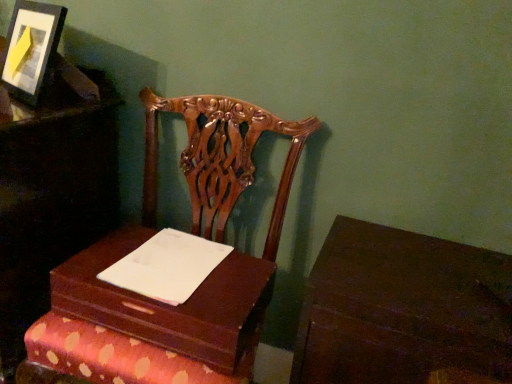
Image resolution: width=512 pixels, height=384 pixels. Describe the element at coordinates (167, 266) in the screenshot. I see `white paper at center` at that location.

Where is `wooden chair at left, which is the first furniture in left-to-right order`? This screenshot has height=384, width=512. wooden chair at left, which is the first furniture in left-to-right order is located at coordinates (53, 197).

At what (x,y) coordinates should I click in order to perform the action: click on white paper at center. Please return your answer as a coordinate pair (x, y). This screenshot has width=512, height=384. Looking at the image, I should click on (167, 266).

From a real-world perspective, is dark wood table at lower right physically above matte black picture frame at upper left?

Incorrect, from a real-world perspective, dark wood table at lower right is lower than matte black picture frame at upper left.

Based on the photo, which of these two, dark wood table at lower right or matte black picture frame at upper left, stands shorter?

matte black picture frame at upper left is shorter.

At what (x,y) coordinates should I click in order to perform the action: click on table located underneath the matte black picture frame at upper left (from a real-world perspective). Please return your answer as a coordinate pair (x, y). The width and height of the screenshot is (512, 384). Looking at the image, I should click on (403, 309).

Which object is further away from the camera, dark wood table at lower right or matte black picture frame at upper left?

Positioned behind is matte black picture frame at upper left.

From the image's perspective, between matte black picture frame at upper left and dark wood table at lower right, who is located below?

dark wood table at lower right is shown below in the image.

Considering the positions of objects matte black picture frame at upper left and dark wood table at lower right in the image provided, who is behind, matte black picture frame at upper left or dark wood table at lower right?

matte black picture frame at upper left is more distant.

Considering the relative sizes of matte black picture frame at upper left and dark wood table at lower right in the image provided, is matte black picture frame at upper left bigger than dark wood table at lower right?

Actually, matte black picture frame at upper left might be smaller than dark wood table at lower right.

Based on the photo, is matte black picture frame at upper left aimed at dark wood table at lower right?

No.

From a real-world perspective, which is physically below, white paper at center or dark wood table at lower right?

dark wood table at lower right, from a real-world perspective.

In the scene shown: In terms of height, does white paper at center look taller or shorter compared to dark wood table at lower right?

In the image, white paper at center appears to be shorter than dark wood table at lower right.

Which object is closer to the camera, white paper at center or dark wood table at lower right?

dark wood table at lower right is more forward.

Looking at this image, is mahogany wood chair at center, the 1th furniture positioned from the right, facing away from wooden chair at left, marked as the 2th furniture in a right-to-left arrangement?

No, mahogany wood chair at center, the 1th furniture positioned from the right, is not facing the opposite direction of wooden chair at left, marked as the 2th furniture in a right-to-left arrangement.

From a real-world perspective, is mahogany wood chair at center, the 2th furniture viewed from the left, over wooden chair at left, which is the first furniture in left-to-right order?

Yes, from a real-world perspective, mahogany wood chair at center, the 2th furniture viewed from the left, is above wooden chair at left, which is the first furniture in left-to-right order.

Looking at this image, is mahogany wood chair at center, the 1th furniture positioned from the right, to the left or to the right of wooden chair at left, which is the first furniture in left-to-right order, in the image?

From the image, it's evident that mahogany wood chair at center, the 1th furniture positioned from the right, is to the right of wooden chair at left, which is the first furniture in left-to-right order.

Is mahogany wood chair at center, the 1th furniture positioned from the right, situated inside wooden chair at left, which is the first furniture in left-to-right order, or outside?

mahogany wood chair at center, the 1th furniture positioned from the right, exists outside the volume of wooden chair at left, which is the first furniture in left-to-right order.

Is mahogany wood chair at center, the 1th furniture positioned from the right, facing towards white paper at center?

Yes, mahogany wood chair at center, the 1th furniture positioned from the right, is aimed at white paper at center.

From the image's perspective, which is above, mahogany wood chair at center, the 1th furniture positioned from the right, or white paper at center?

white paper at center is shown above in the image.

Can you confirm if mahogany wood chair at center, the 2th furniture viewed from the left, is smaller than white paper at center?

Incorrect, mahogany wood chair at center, the 2th furniture viewed from the left, is not smaller in size than white paper at center.

Measure the distance from mahogany wood chair at center, the 2th furniture viewed from the left, to white paper at center.

mahogany wood chair at center, the 2th furniture viewed from the left, is 12.03 centimeters from white paper at center.

Does point (453, 280) lie behind point (165, 288)?

No, it is not.

Measure the distance between dark wood table at lower right and white paper at center.

The distance of dark wood table at lower right from white paper at center is 16.82 inches.

How different are the orientations of dark wood table at lower right and white paper at center in degrees?

The angle between the facing direction of dark wood table at lower right and the facing direction of white paper at center is 2.34 degrees.

Considering the sizes of objects dark wood table at lower right and white paper at center in the image provided, who is taller, dark wood table at lower right or white paper at center?

dark wood table at lower right is taller.

Are matte black picture frame at upper left and wooden box at center located far from each other?

Actually, matte black picture frame at upper left and wooden box at center are a little close together.

Measure the distance between matte black picture frame at upper left and wooden box at center.

matte black picture frame at upper left and wooden box at center are 22.30 inches apart from each other.

From the image's perspective, is matte black picture frame at upper left located above or below wooden box at center?

matte black picture frame at upper left is situated higher than wooden box at center in the image.

Is matte black picture frame at upper left positioned beyond the bounds of wooden box at center?

Yes, matte black picture frame at upper left is outside of wooden box at center.

This screenshot has height=384, width=512. What are the coordinates of `table lying below the matte black picture frame at upper left (from the image's perspective)` in the screenshot? It's located at [x=403, y=309].

Locate an element on the screen. picture frame that appears above the dark wood table at lower right (from the image's perspective) is located at coordinates (31, 47).

Looking at the image, which one is located further to wooden chair at left, marked as the 2th furniture in a right-to-left arrangement, matte black picture frame at upper left or mahogany wood chair at center, the 1th furniture positioned from the right?

The object further to wooden chair at left, marked as the 2th furniture in a right-to-left arrangement, is mahogany wood chair at center, the 1th furniture positioned from the right.

Looking at the image, which one is located further to mahogany wood chair at center, the 2th furniture viewed from the left, matte black picture frame at upper left or white paper at center?

matte black picture frame at upper left is further to mahogany wood chair at center, the 2th furniture viewed from the left.

Which object lies nearer to the anchor point mahogany wood chair at center, the 2th furniture viewed from the left, wooden chair at left, marked as the 2th furniture in a right-to-left arrangement, or white paper at center?

Based on the image, white paper at center appears to be nearer to mahogany wood chair at center, the 2th furniture viewed from the left.

Considering their positions, is wooden box at center positioned closer to dark wood table at lower right than matte black picture frame at upper left?

wooden box at center is positioned closer to the anchor dark wood table at lower right.

Based on their spatial positions, is wooden chair at left, marked as the 2th furniture in a right-to-left arrangement, or matte black picture frame at upper left further from dark wood table at lower right?

matte black picture frame at upper left.

Considering their positions, is matte black picture frame at upper left positioned closer to wooden chair at left, marked as the 2th furniture in a right-to-left arrangement, than dark wood table at lower right?

The object closer to wooden chair at left, marked as the 2th furniture in a right-to-left arrangement, is matte black picture frame at upper left.

Estimate the real-world distances between objects in this image. Which object is closer to matte black picture frame at upper left, dark wood table at lower right or wooden chair at left, which is the first furniture in left-to-right order?

wooden chair at left, which is the first furniture in left-to-right order, is positioned closer to the anchor matte black picture frame at upper left.

Which object lies further to the anchor point matte black picture frame at upper left, mahogany wood chair at center, the 2th furniture viewed from the left, or wooden chair at left, which is the first furniture in left-to-right order?

mahogany wood chair at center, the 2th furniture viewed from the left, lies further to matte black picture frame at upper left than the other object.

Locate an element on the screen. Image resolution: width=512 pixels, height=384 pixels. furniture between wooden chair at left, marked as the 2th furniture in a right-to-left arrangement, and dark wood table at lower right from left to right is located at coordinates (199, 286).

Find the location of a particular element. This screenshot has height=384, width=512. box between mahogany wood chair at center, the 2th furniture viewed from the left, and dark wood table at lower right from left to right is located at coordinates [170, 305].

Identify the location of box between matte black picture frame at upper left and mahogany wood chair at center, the 1th furniture positioned from the right, in the up-down direction. (170, 305).

Where is `notepad between mahogany wood chair at center, the 2th furniture viewed from the left, and dark wood table at lower right, in the horizontal direction`? notepad between mahogany wood chair at center, the 2th furniture viewed from the left, and dark wood table at lower right, in the horizontal direction is located at coordinates (167, 266).